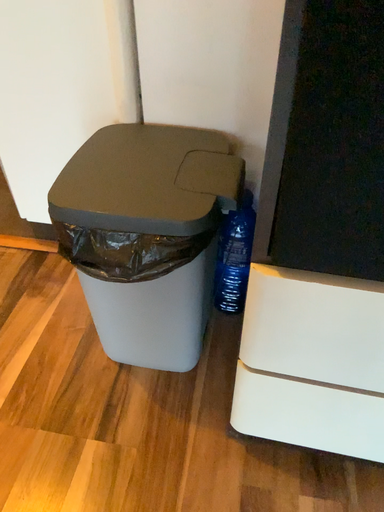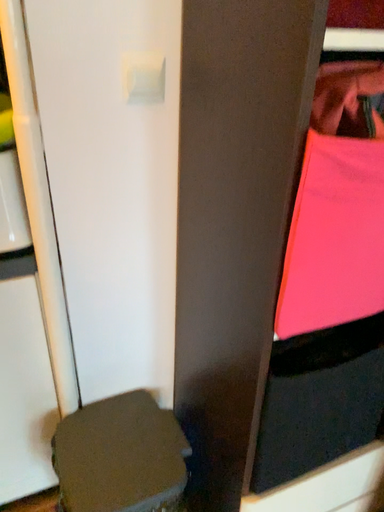
Question: How did the camera likely rotate when shooting the video?

Choices:
 (A) rotated left
 (B) rotated right

Answer: (B)